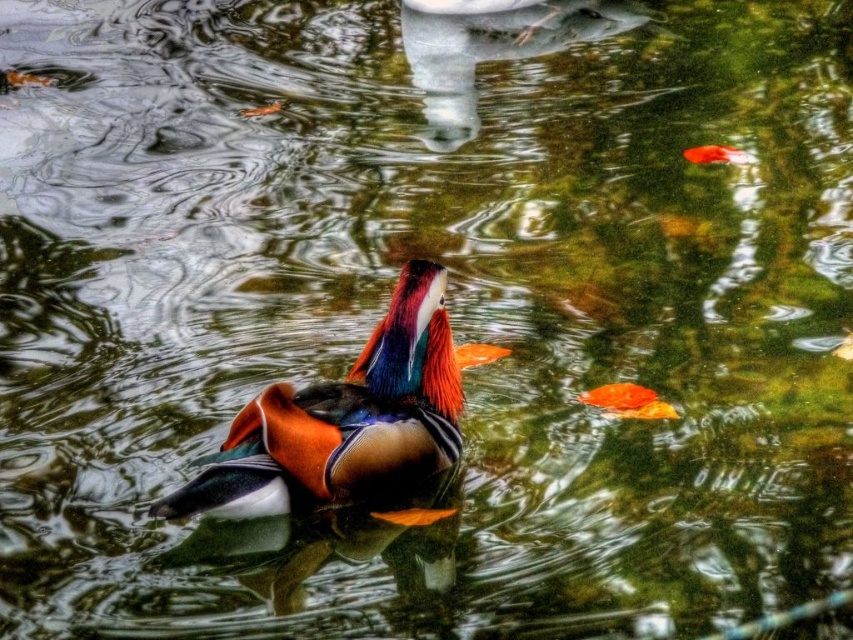
Measure the distance between shiny multicolored duck at center and orange glossy goldfish at center.

3.90 feet

Which is in front, point (287, 403) or point (496, 356)?

Point (287, 403) is in front.

Does point (276, 444) come farther from viewer compared to point (473, 365)?

That is False.

You are a GUI agent. You are given a task and a screenshot of the screen. Output one action in this format:
    pyautogui.click(x=<x>, y=<y>)
    Task: Click on the shiny multicolored duck at center
    
    Given the screenshot: What is the action you would take?
    pyautogui.click(x=344, y=420)

Does shiny orange fish at upper right have a smaller size compared to orange glossy goldfish at center?

Actually, shiny orange fish at upper right might be larger than orange glossy goldfish at center.

Is point (703, 145) farther from camera compared to point (471, 349)?

Yes, it is.

Locate an element on the screen. The width and height of the screenshot is (853, 640). shiny orange fish at upper right is located at coordinates (717, 154).

I want to click on shiny orange fish at upper right, so click(x=717, y=154).

Who is lower down, shiny orange fish at lower right or orange glossy goldfish at center?

shiny orange fish at lower right is below.

Between point (637, 413) and point (463, 353), which one is positioned in front?

Point (637, 413)

The width and height of the screenshot is (853, 640). What do you see at coordinates (628, 401) in the screenshot?
I see `shiny orange fish at lower right` at bounding box center [628, 401].

Locate an element on the screen. The height and width of the screenshot is (640, 853). shiny orange fish at lower right is located at coordinates (628, 401).